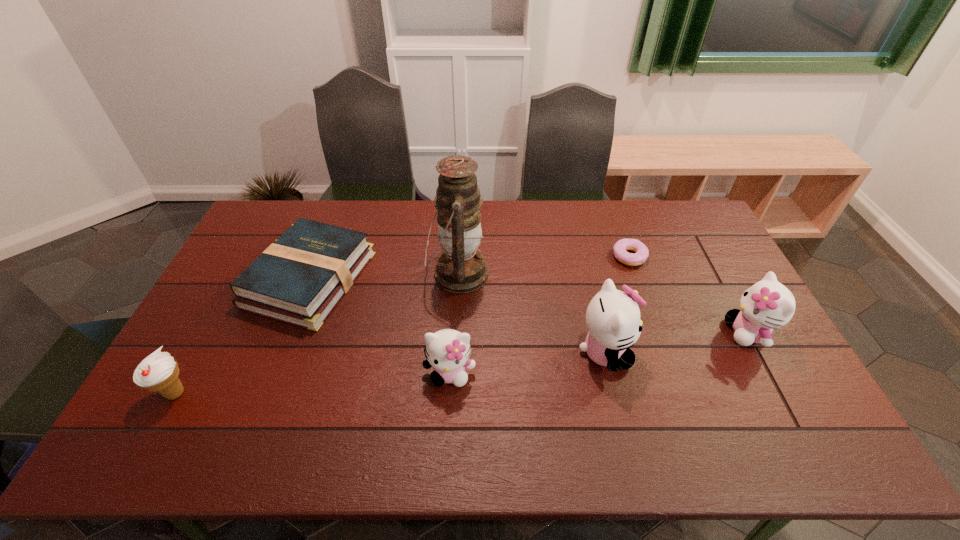
Locate an element on the screen. This screenshot has width=960, height=540. the shortest kitten is located at coordinates (448, 351).

Where is `the second kitten from right to left`? The width and height of the screenshot is (960, 540). the second kitten from right to left is located at coordinates (613, 320).

In order to click on the rightmost object in this screenshot , I will do `click(766, 305)`.

Image resolution: width=960 pixels, height=540 pixels. In order to click on the rightmost kitten in this screenshot , I will do `click(766, 305)`.

Locate an element on the screen. The height and width of the screenshot is (540, 960). the sixth tallest object is located at coordinates (x=299, y=279).

Image resolution: width=960 pixels, height=540 pixels. Find the location of `the tallest object`. the tallest object is located at coordinates (461, 268).

Where is `the sixth object from left to right`? the sixth object from left to right is located at coordinates (641, 254).

Locate an element on the screen. The image size is (960, 540). the shortest object is located at coordinates (641, 254).

Find the location of a particular element. The width and height of the screenshot is (960, 540). icecream is located at coordinates point(158,372).

Where is `free space located 0.050m on the front-facing side of the leftmost kitten`? Image resolution: width=960 pixels, height=540 pixels. free space located 0.050m on the front-facing side of the leftmost kitten is located at coordinates (447, 408).